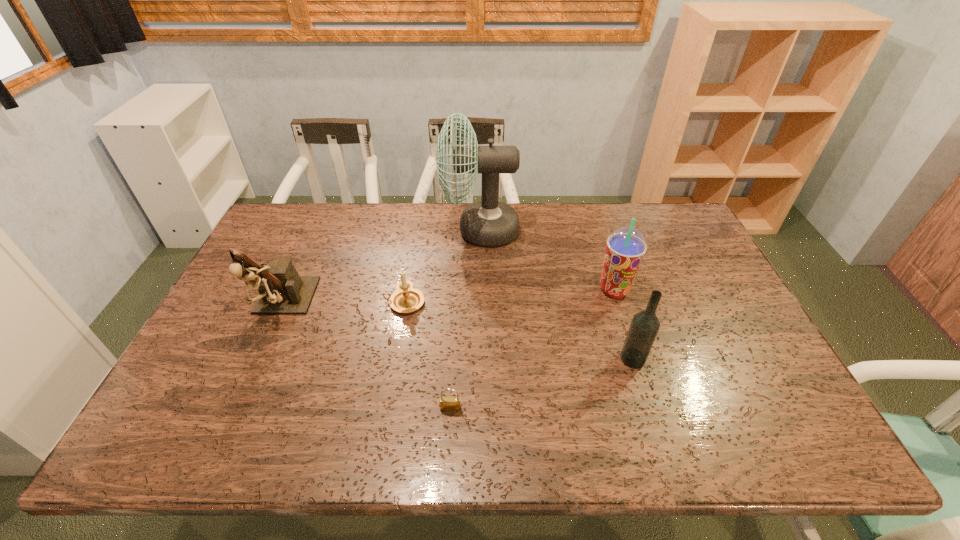
The image size is (960, 540). Find the location of `vacant space at the far edge of the desktop`. vacant space at the far edge of the desktop is located at coordinates (349, 237).

This screenshot has width=960, height=540. I want to click on blank area at the near edge, so click(x=730, y=418).

In the image, there is a desktop. Where is `free region at the left edge`? Image resolution: width=960 pixels, height=540 pixels. free region at the left edge is located at coordinates (200, 366).

In the image, there is a desktop. Where is `vacant space at the right edge`? This screenshot has height=540, width=960. vacant space at the right edge is located at coordinates (680, 288).

Locate an element on the screen. vacant region at the far left corner is located at coordinates (290, 221).

Where is `vacant space at the near right corner`? vacant space at the near right corner is located at coordinates (788, 424).

At what (x,y) coordinates should I click in order to perform the action: click on empty space between the leftmost object and the second object from left to right. Please return your answer as a coordinate pair (x, y). The image size is (960, 540). Looking at the image, I should click on (343, 305).

Image resolution: width=960 pixels, height=540 pixels. In order to click on vacant area that lies between the second nearest object and the leftmost object in this screenshot , I will do `click(457, 333)`.

Where is `vacant space in between the fifth farthest object and the smoothie`? This screenshot has width=960, height=540. vacant space in between the fifth farthest object and the smoothie is located at coordinates (623, 324).

This screenshot has width=960, height=540. Find the location of `free space between the vodka and the shortest object`. free space between the vodka and the shortest object is located at coordinates (541, 383).